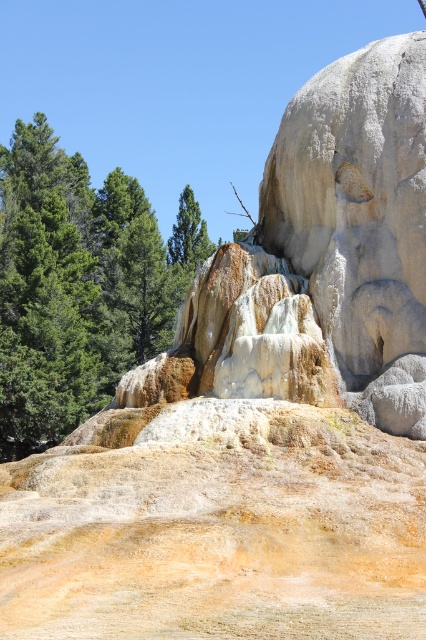
You are standing in the forest looking at the geothermal features. You notice the green textured pine trees at left and the green matte tree at center. Which tree is closer to you?

The green textured pine trees at left are closer to you because they are positioned under the green matte tree at center, meaning they are in front of it from your viewpoint.

You are standing in front of the terraced formations and want to take a photo that includes both the green textured pine trees at left and the green matte tree at center. Which tree should you focus on first to ensure both are in sharp focus?

You should focus on the green textured pine trees at left first because it is closer to you than the green matte tree at center. By focusing on the closer object, the farther one will also be in focus due to the depth of field.